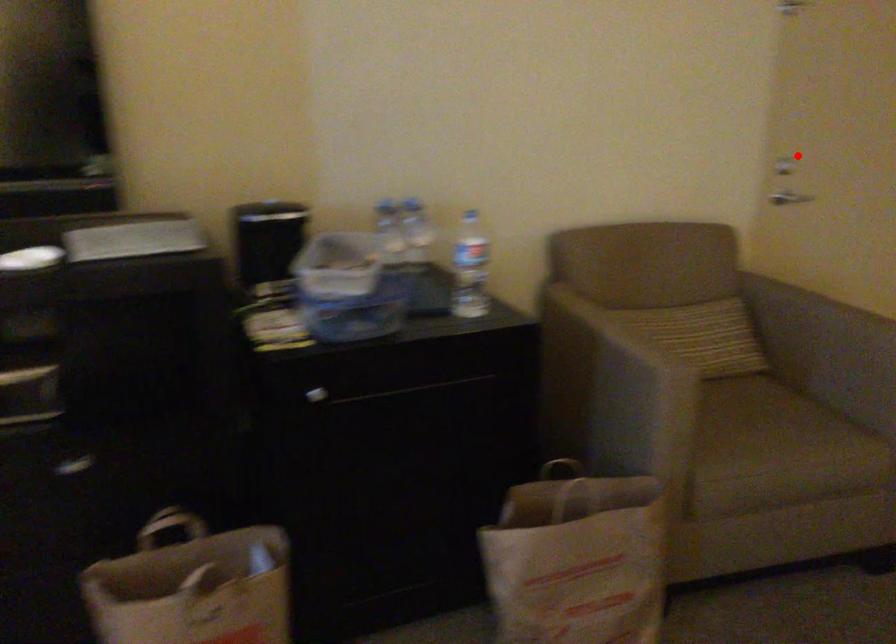
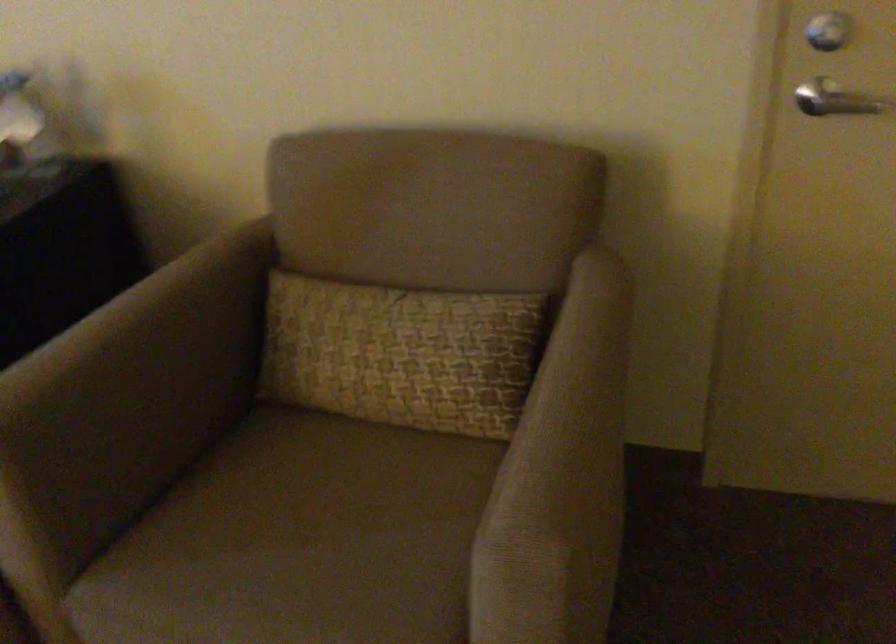
Question: A red point is marked in image1. In image2, is the corresponding 3D point closer to the camera or farther? Reply with the corresponding letter.

Choices:
 (A) The corresponding 3D point is closer.
 (B) The corresponding 3D point is farther.

Answer: (A)